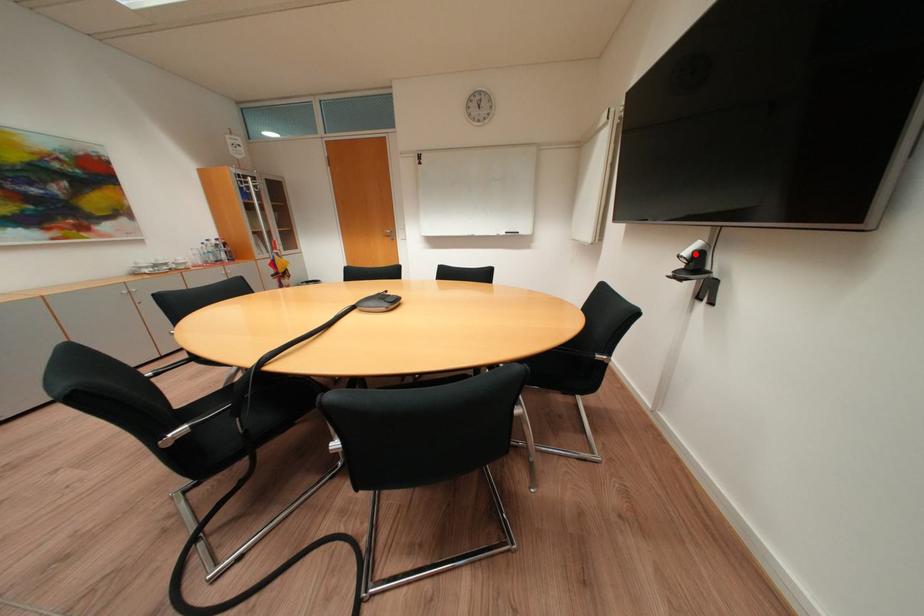
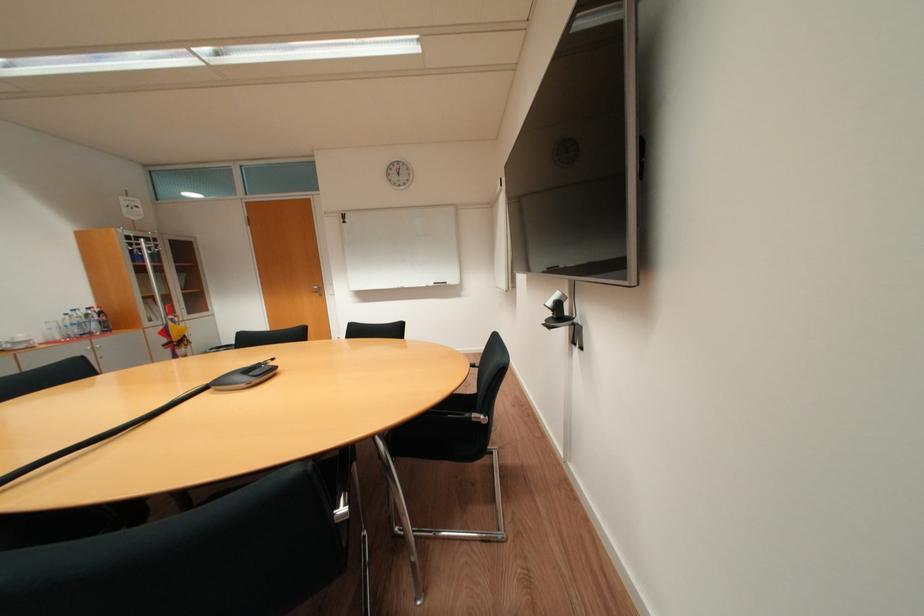
In the second image, find the point that corresponds to the highlighted location in the first image.

(558, 304)